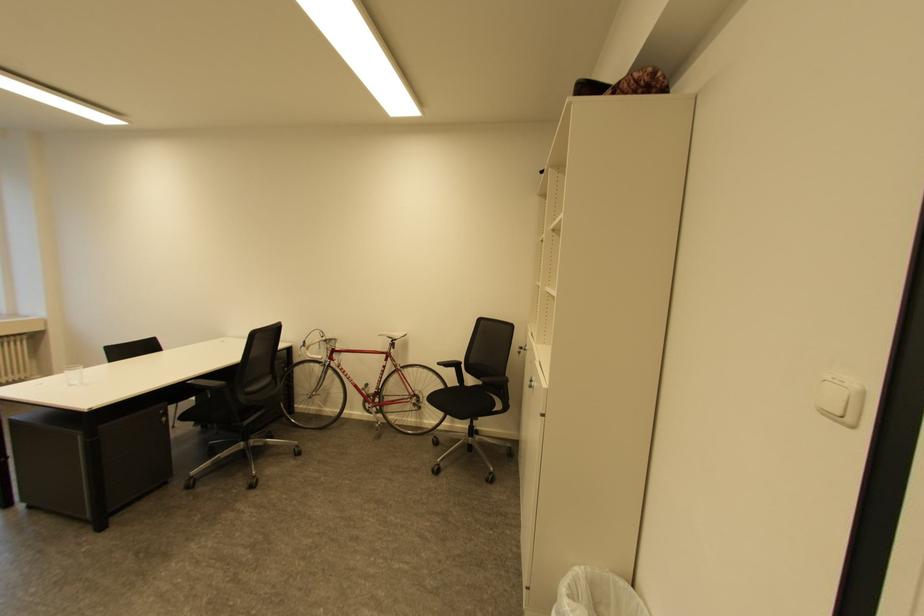
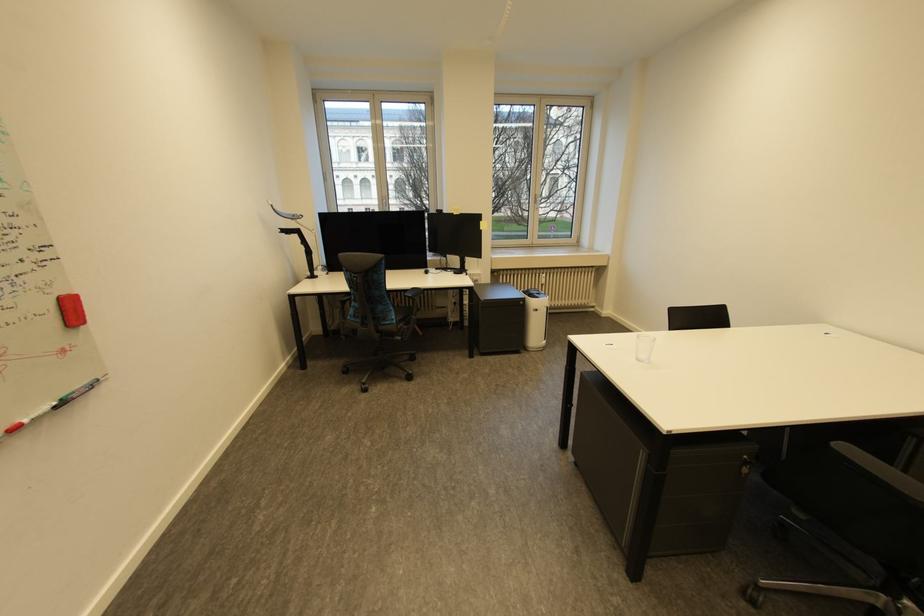
Find the pixel in the second image that matches (x=79, y=386) in the first image.

(646, 361)